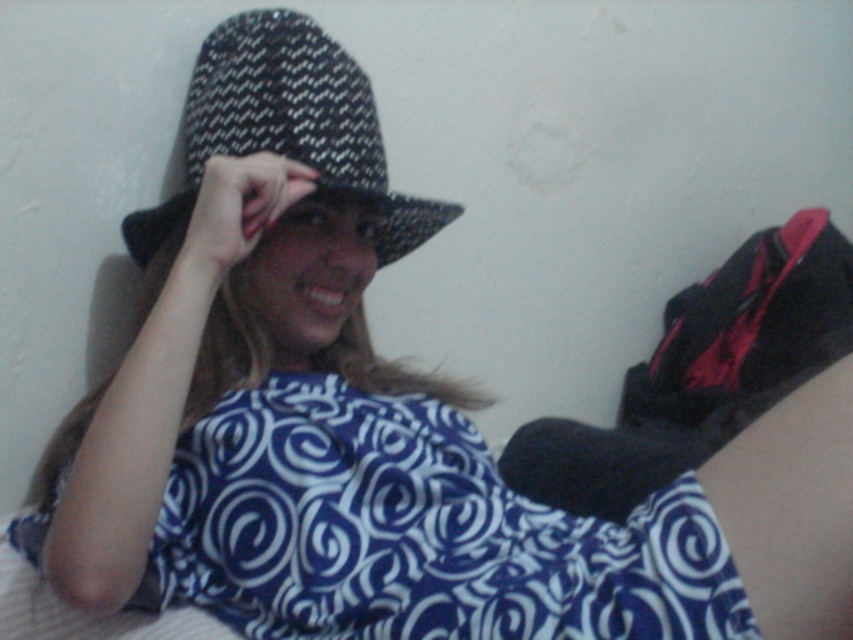
Question: Which point is farther to the camera?

Choices:
 (A) black woven fedora at upper center
 (B) blue printed fabric dress at center

Answer: (A)

Question: Among these objects, which one is nearest to the camera?

Choices:
 (A) blue printed fabric dress at center
 (B) black woven fedora at upper center

Answer: (A)

Question: Is the position of blue printed fabric dress at center less distant than that of black woven fedora at upper center?

Choices:
 (A) yes
 (B) no

Answer: (A)

Question: Does blue printed fabric dress at center come in front of black woven fedora at upper center?

Choices:
 (A) yes
 (B) no

Answer: (A)

Question: Which point is farther to the camera?

Choices:
 (A) blue printed fabric dress at center
 (B) black woven fedora at upper center

Answer: (B)

Question: Can you confirm if blue printed fabric dress at center is positioned below black woven fedora at upper center?

Choices:
 (A) no
 (B) yes

Answer: (B)